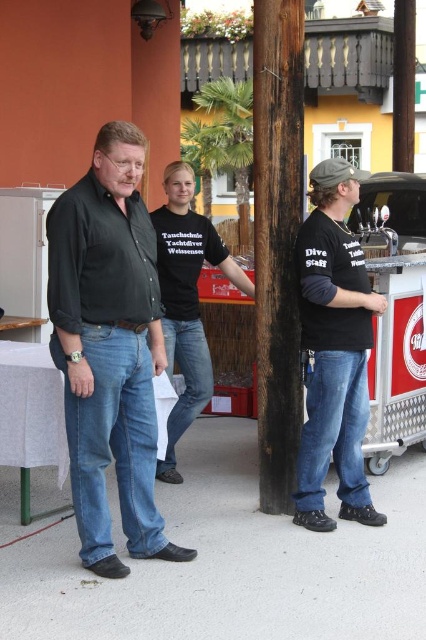
Question: Which of the following is the closest to the observer?

Choices:
 (A) dark brown wood pole at center
 (B) black cotton t-shirt at center
 (C) matte black t-shirt at right

Answer: (C)

Question: Which of the following is the farthest from the observer?

Choices:
 (A) (304, 298)
 (B) (264, 296)
 (C) (94, 497)
 (D) (206, 342)

Answer: (D)

Question: From the image, what is the correct spatial relationship of dark brown wood pole at center in relation to black cotton t-shirt at center?

Choices:
 (A) left
 (B) right

Answer: (B)

Question: Which point is closer to the camera?

Choices:
 (A) black cotton t-shirt at center
 (B) matte black t-shirt at right
 (C) dark brown wood pole at center
 (D) matte black shirt at center

Answer: (D)

Question: Is dark brown wood pole at center in front of matte black t-shirt at right?

Choices:
 (A) no
 (B) yes

Answer: (A)

Question: Does matte black shirt at center have a larger size compared to matte black t-shirt at right?

Choices:
 (A) no
 (B) yes

Answer: (B)